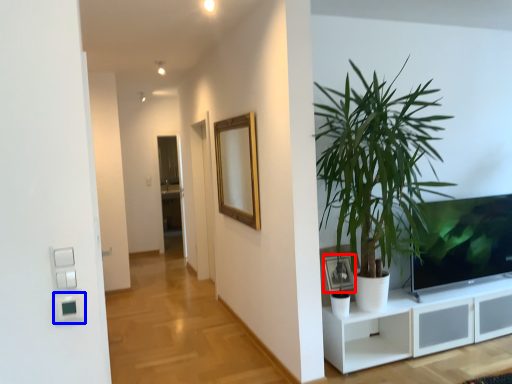
Question: Among these objects, which one is farthest to the camera, picture frame (highlighted by a red box) or light switch (highlighted by a blue box)?

Choices:
 (A) picture frame
 (B) light switch

Answer: (A)